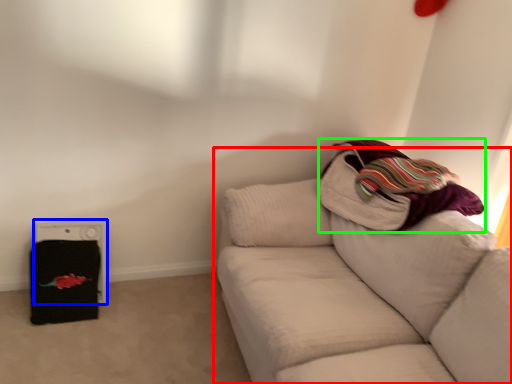
Question: Which object is positioned farthest from studio couch (highlighted by a red box)? Select from appliance (highlighted by a blue box) and blanket (highlighted by a green box).

Choices:
 (A) appliance
 (B) blanket

Answer: (A)